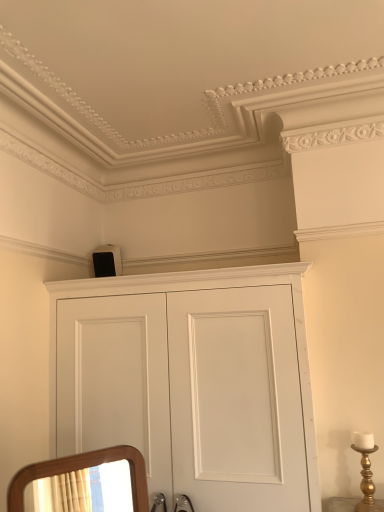
Question: Is white matte cupboard at upper center closer to camera compared to white matte speaker at upper center?

Choices:
 (A) yes
 (B) no

Answer: (A)

Question: Does white matte cupboard at upper center appear on the left side of white matte speaker at upper center?

Choices:
 (A) yes
 (B) no

Answer: (B)

Question: Is white matte cupboard at upper center to the right of white matte speaker at upper center from the viewer's perspective?

Choices:
 (A) yes
 (B) no

Answer: (A)

Question: Considering the relative sizes of white matte cupboard at upper center and white matte speaker at upper center in the image provided, is white matte cupboard at upper center bigger than white matte speaker at upper center?

Choices:
 (A) no
 (B) yes

Answer: (B)

Question: Is white matte cupboard at upper center looking in the opposite direction of white matte speaker at upper center?

Choices:
 (A) no
 (B) yes

Answer: (A)

Question: Is point (100, 248) positioned closer to the camera than point (244, 379)?

Choices:
 (A) closer
 (B) farther

Answer: (B)

Question: From the image's perspective, is white matte speaker at upper center located above or below white matte cupboard at upper center?

Choices:
 (A) below
 (B) above

Answer: (B)

Question: Is white matte speaker at upper center inside or outside of white matte cupboard at upper center?

Choices:
 (A) outside
 (B) inside

Answer: (A)

Question: From a real-world perspective, relative to white matte cupboard at upper center, is white matte speaker at upper center vertically above or below?

Choices:
 (A) below
 (B) above

Answer: (B)

Question: From the image's perspective, is white matte cupboard at upper center positioned above or below gold metallic candle holder at right?

Choices:
 (A) below
 (B) above

Answer: (B)

Question: Is white matte cupboard at upper center bigger or smaller than gold metallic candle holder at right?

Choices:
 (A) small
 (B) big

Answer: (B)

Question: Considering the positions of point (271, 461) and point (365, 487), is point (271, 461) closer or farther from the camera than point (365, 487)?

Choices:
 (A) closer
 (B) farther

Answer: (A)

Question: Is white matte cupboard at upper center to the left or to the right of gold metallic candle holder at right in the image?

Choices:
 (A) right
 (B) left

Answer: (B)

Question: From their relative heights in the image, would you say white matte speaker at upper center is taller or shorter than gold metallic candle holder at right?

Choices:
 (A) short
 (B) tall

Answer: (A)

Question: Is point (109, 273) positioned closer to the camera than point (357, 510)?

Choices:
 (A) closer
 (B) farther

Answer: (B)